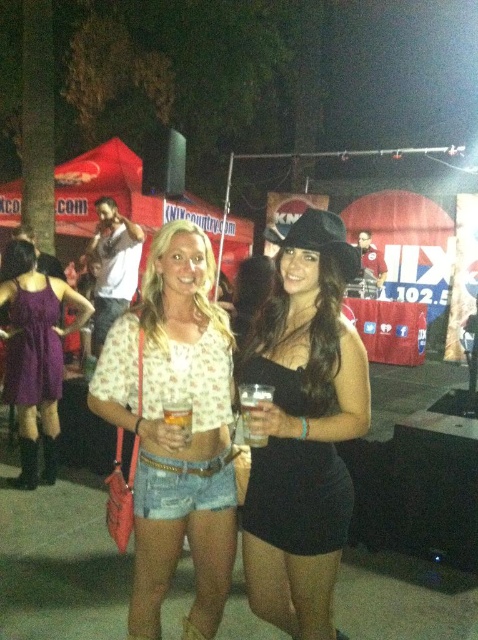
Question: Which object appears farthest from the camera in this image?

Choices:
 (A) denim shorts at center
 (B) black satin dress at lower right
 (C) purple satin dress at lower left

Answer: (C)

Question: Which object appears closest to the camera in this image?

Choices:
 (A) purple satin dress at left
 (B) purple satin dress at lower left

Answer: (B)

Question: Can you confirm if black satin dress at lower right is positioned to the right of purple satin dress at left?

Choices:
 (A) yes
 (B) no

Answer: (A)

Question: Does denim shorts at center have a larger size compared to purple satin dress at lower left?

Choices:
 (A) yes
 (B) no

Answer: (B)

Question: In this image, where is purple satin dress at lower left located relative to translucent glass cup at center?

Choices:
 (A) below
 (B) above

Answer: (B)

Question: Which object is closer to the camera taking this photo?

Choices:
 (A) black matte hat at center
 (B) purple satin dress at lower left
 (C) purple satin dress at left
 (D) black satin dress at lower right

Answer: (A)